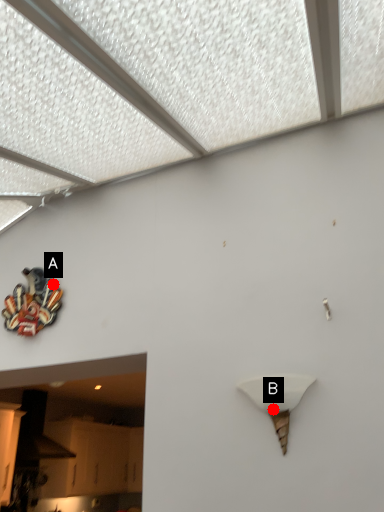
Question: Two points are circled on the image, labeled by A and B beside each circle. Which point appears farthest from the camera in this image?

Choices:
 (A) A is further
 (B) B is further

Answer: (A)